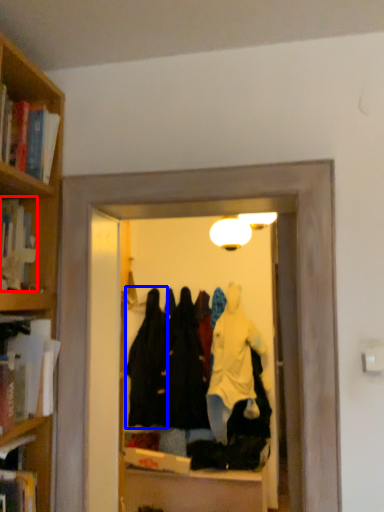
Question: Which object is further to the camera taking this photo, book (highlighted by a red box) or clothing (highlighted by a blue box)?

Choices:
 (A) book
 (B) clothing

Answer: (B)